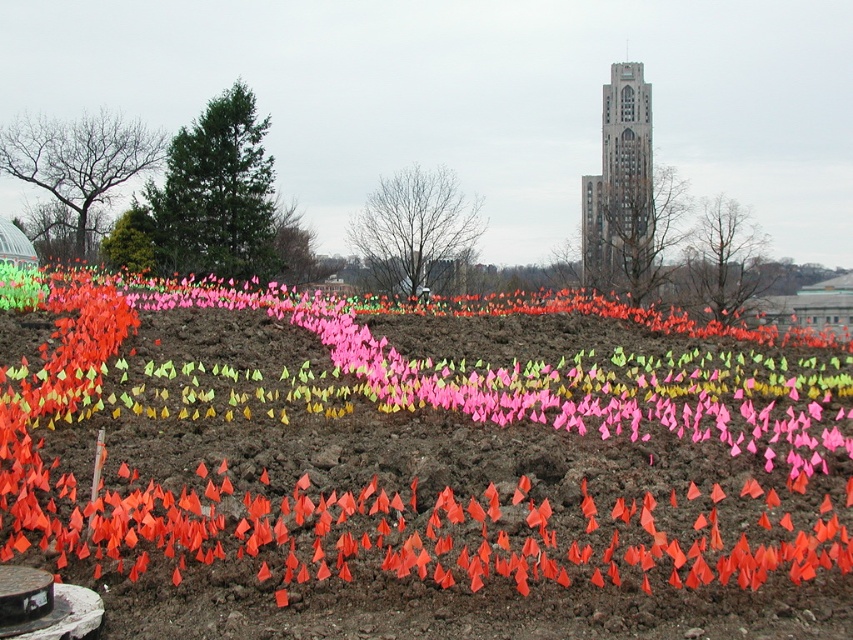
Between orange paper flags at lower left and gray stone bell tower at upper center, which one is positioned lower?

orange paper flags at lower left is below.

From the picture: Does orange paper flags at lower left have a greater height compared to gray stone bell tower at upper center?

No, orange paper flags at lower left is not taller than gray stone bell tower at upper center.

What are the coordinates of `orange paper flags at lower left` in the screenshot? It's located at (393, 412).